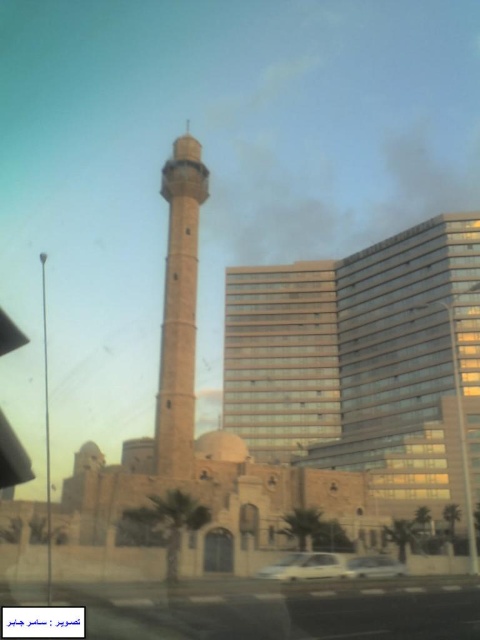
Question: Does beige stone tower at center lie behind beige stone minaret at center?

Choices:
 (A) yes
 (B) no

Answer: (A)

Question: Which object appears closest to the camera in this image?

Choices:
 (A) beige stone minaret at center
 (B) transparent plastic car window at center
 (C) beige stone tower at center

Answer: (B)

Question: Which of these objects is positioned closest to the transparent plastic car window at center?

Choices:
 (A) metallic silver car at center
 (B) beige stone tower at center
 (C) white plastic car at center

Answer: (C)

Question: Can you confirm if beige stone tower at center is wider than metallic silver car at center?

Choices:
 (A) yes
 (B) no

Answer: (A)

Question: Does beige stone tower at center come behind white plastic car at center?

Choices:
 (A) no
 (B) yes

Answer: (B)

Question: Which object is farther from the camera taking this photo?

Choices:
 (A) transparent plastic car window at center
 (B) beige stone minaret at center
 (C) white plastic car at center

Answer: (B)